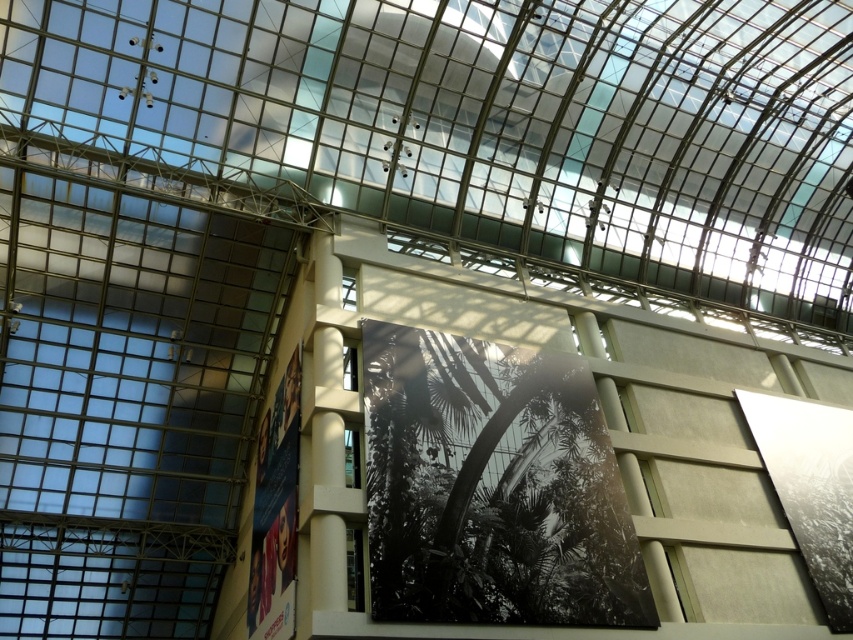
Based on the photo, you are standing in the modern building and want to look outside through the transparent glass window at lower center. Where should you look to find it?

The transparent glass window at lower center is located at point (354,568).

You are standing in the modern building with a glass roof. There is a point at coordinates point (352, 561). Can you see this point clearly from where you are standing?

The point (352, 561) is 26.75 meters away from the viewer. Since the distance is quite far, it might be difficult to see the point clearly without any visual aids.